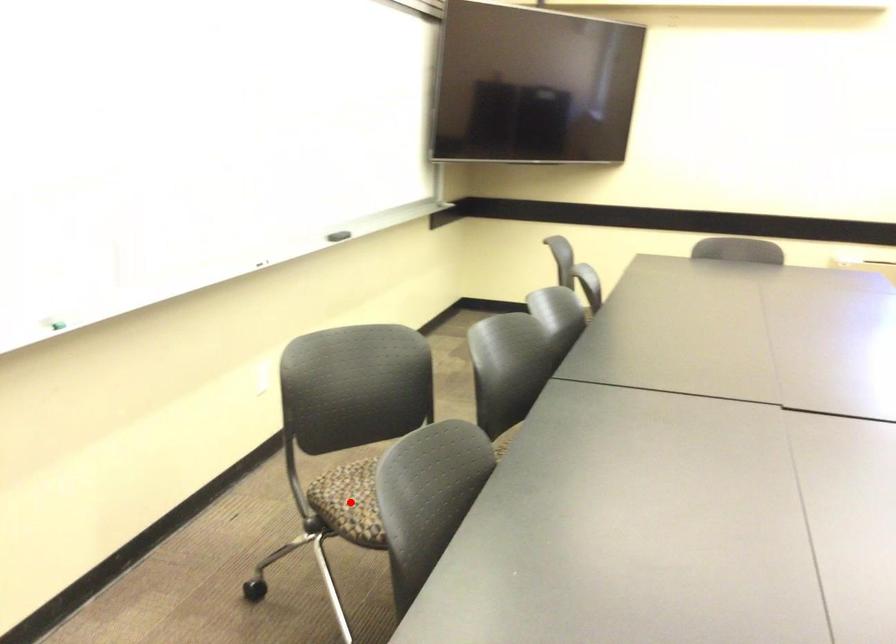
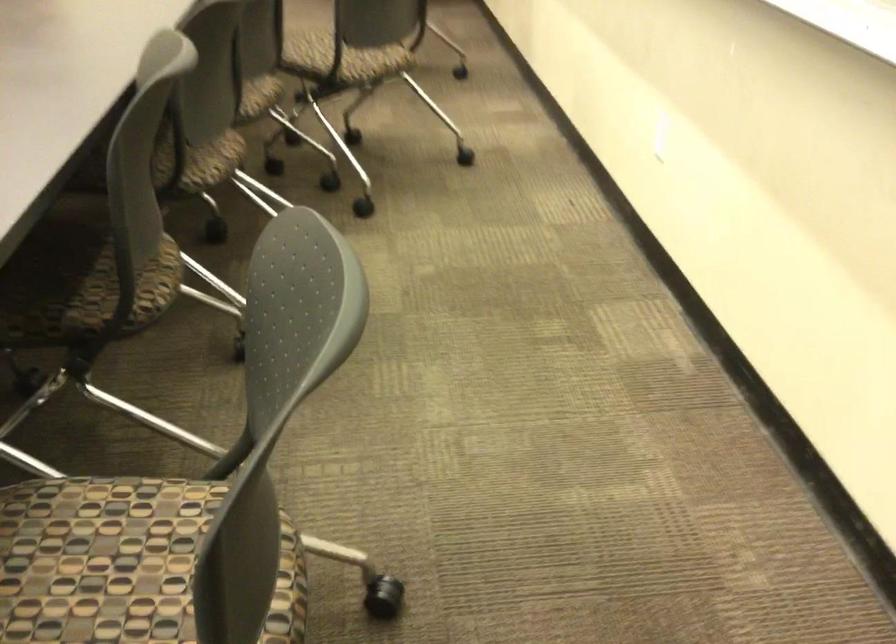
Question: I am providing you with two images of the same scene from different viewpoints. A red point is marked on the first image. At the location where the point appears in image 1, is it still visible in image 2?

Choices:
 (A) Yes
 (B) No

Answer: (B)